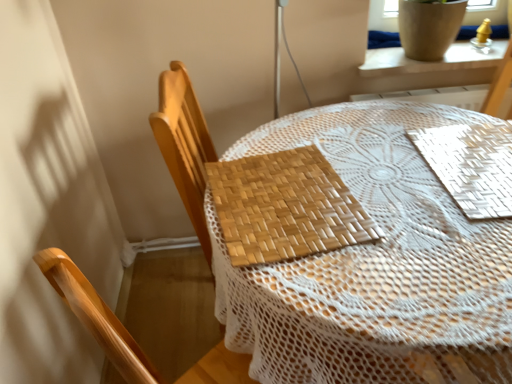
Where is `bamboo placemat at center`? The width and height of the screenshot is (512, 384). bamboo placemat at center is located at coordinates (374, 265).

What do you see at coordinates (374, 265) in the screenshot?
I see `bamboo placemat at center` at bounding box center [374, 265].

Describe the element at coordinates (285, 207) in the screenshot. The height and width of the screenshot is (384, 512). I see `woven wood placemat at center, marked as the first mat in a left-to-right arrangement` at that location.

What is the approximate height of woven wood placemat at center, marked as the first mat in a left-to-right arrangement?

0.93 inches.

Describe the element at coordinates (432, 62) in the screenshot. I see `white ceramic pot at upper right` at that location.

Find the location of a particular element. woven wood chair at center is located at coordinates (184, 145).

What do you see at coordinates (184, 145) in the screenshot?
I see `woven wood chair at center` at bounding box center [184, 145].

Where is `bamboo placemat at center`? The height and width of the screenshot is (384, 512). bamboo placemat at center is located at coordinates (374, 265).

Is woven wood placemat at center, the 2th mat positioned from the right, positioned far away from white ceramic pot at upper right?

No, woven wood placemat at center, the 2th mat positioned from the right, is in close proximity to white ceramic pot at upper right.

How distant is woven wood placemat at center, marked as the first mat in a left-to-right arrangement, from white ceramic pot at upper right?

They are 30.35 inches apart.

From the image's perspective, is woven wood placemat at center, marked as the first mat in a left-to-right arrangement, below white ceramic pot at upper right?

Indeed, from the image's perspective, woven wood placemat at center, marked as the first mat in a left-to-right arrangement, is shown beneath white ceramic pot at upper right.

Does woven wood chair at center lie behind woven wood placemat at center, marked as the first mat in a left-to-right arrangement?

Yes, it is.

This screenshot has width=512, height=384. I want to click on chair lying behind the woven wood placemat at center, marked as the first mat in a left-to-right arrangement, so click(184, 145).

Is woven wood chair at center not close to woven wood placemat at center, the 2th mat positioned from the right?

Actually, woven wood chair at center and woven wood placemat at center, the 2th mat positioned from the right, are a little close together.

Is woven wood placemat at center, marked as the first mat in a left-to-right arrangement, completely or partially inside woven wood chair at center?

No, woven wood placemat at center, marked as the first mat in a left-to-right arrangement, is located outside of woven wood chair at center.

Considering the relative positions of white ceramic pot at upper right and woven wood chair at center in the image provided, is white ceramic pot at upper right to the left or to the right of woven wood chair at center?

In the image, white ceramic pot at upper right appears on the right side of woven wood chair at center.

Does white ceramic pot at upper right have a lesser height compared to woven wood chair at center?

Correct, white ceramic pot at upper right is not as tall as woven wood chair at center.

Could you tell me if white ceramic pot at upper right is facing woven wood chair at center?

No, white ceramic pot at upper right does not turn towards woven wood chair at center.

Identify the location of chair in front of the white ceramic pot at upper right. (184, 145).

Considering the relative positions of bamboo placemat at center and white woven mat at upper right, arranged as the first mat when viewed from the right, in the image provided, is bamboo placemat at center to the left of white woven mat at upper right, arranged as the first mat when viewed from the right, from the viewer's perspective?

Indeed, bamboo placemat at center is positioned on the left side of white woven mat at upper right, arranged as the first mat when viewed from the right.

Who is taller, bamboo placemat at center or white woven mat at upper right, arranged as the second mat when viewed from the left?

Standing taller between the two is bamboo placemat at center.

What are the coordinates of `mat that is the 1st one above the bamboo placemat at center (from a real-world perspective)` in the screenshot? It's located at (471, 165).

Between point (197, 212) and point (418, 68), which one is positioned in front?

Point (197, 212)

Between woven wood chair at center and white ceramic pot at upper right, which one has more height?

woven wood chair at center is taller.

From a real-world perspective, between woven wood chair at center and white ceramic pot at upper right, who is vertically lower?

In real-world perspective, woven wood chair at center is lower.

Which object is wider, woven wood chair at center or white ceramic pot at upper right?

With larger width is woven wood chair at center.

From the image's perspective, is white ceramic pot at upper right over white woven mat at upper right, arranged as the second mat when viewed from the left?

Yes.

Considering the relative positions of white ceramic pot at upper right and white woven mat at upper right, arranged as the second mat when viewed from the left, in the image provided, is white ceramic pot at upper right to the left or to the right of white woven mat at upper right, arranged as the second mat when viewed from the left,?

From the image, it's evident that white ceramic pot at upper right is to the right of white woven mat at upper right, arranged as the second mat when viewed from the left.

Does white ceramic pot at upper right have a greater width compared to white woven mat at upper right, arranged as the first mat when viewed from the right?

No, white ceramic pot at upper right is not wider than white woven mat at upper right, arranged as the first mat when viewed from the right.

From a real-world perspective, which is physically below, white ceramic pot at upper right or white woven mat at upper right, arranged as the second mat when viewed from the left?

In real-world perspective, white woven mat at upper right, arranged as the second mat when viewed from the left, is lower.

Is point (471, 53) closer to viewer compared to point (380, 136)?

No, (471, 53) is behind (380, 136).

From the image's perspective, which is below, white ceramic pot at upper right or bamboo placemat at center?

bamboo placemat at center appears lower in the image.

Is white ceramic pot at upper right beside bamboo placemat at center?

white ceramic pot at upper right and bamboo placemat at center are clearly separated.

Where is `window sill above the woven wood placemat at center, the 2th mat positioned from the right (from a real-world perspective)`? This screenshot has width=512, height=384. window sill above the woven wood placemat at center, the 2th mat positioned from the right (from a real-world perspective) is located at coordinates (432, 62).

At what (x,y) coordinates should I click in order to perform the action: click on mat that is the 2nd one when counting forward from the woven wood chair at center. Please return your answer as a coordinate pair (x, y). The height and width of the screenshot is (384, 512). Looking at the image, I should click on (285, 207).

Which object lies further to the anchor point white woven mat at upper right, arranged as the first mat when viewed from the right, woven wood chair at center or white ceramic pot at upper right?

Among the two, woven wood chair at center is located further to white woven mat at upper right, arranged as the first mat when viewed from the right.

From the image, which object appears to be farther from bamboo placemat at center, woven wood placemat at center, the 2th mat positioned from the right, or white ceramic pot at upper right?

Based on the image, white ceramic pot at upper right appears to be further to bamboo placemat at center.

In the scene shown: Estimate the real-world distances between objects in this image. Which object is closer to woven wood chair at center, white ceramic pot at upper right or bamboo placemat at center?

Among the two, bamboo placemat at center is located nearer to woven wood chair at center.

When comparing their distances from woven wood chair at center, does white woven mat at upper right, arranged as the second mat when viewed from the left, or white ceramic pot at upper right seem further?

white ceramic pot at upper right is further to woven wood chair at center.

Estimate the real-world distances between objects in this image. Which object is further from woven wood chair at center, bamboo placemat at center or woven wood placemat at center, the 2th mat positioned from the right?

The object further to woven wood chair at center is bamboo placemat at center.

Looking at the image, which one is located closer to woven wood placemat at center, the 2th mat positioned from the right, white woven mat at upper right, arranged as the second mat when viewed from the left, or white ceramic pot at upper right?

white woven mat at upper right, arranged as the second mat when viewed from the left, is closer to woven wood placemat at center, the 2th mat positioned from the right.

Looking at the image, which one is located closer to woven wood placemat at center, marked as the first mat in a left-to-right arrangement, bamboo placemat at center or white woven mat at upper right, arranged as the first mat when viewed from the right?

bamboo placemat at center is positioned closer to the anchor woven wood placemat at center, marked as the first mat in a left-to-right arrangement.

When comparing their distances from white ceramic pot at upper right, does woven wood placemat at center, marked as the first mat in a left-to-right arrangement, or woven wood chair at center seem closer?

Among the two, woven wood chair at center is located nearer to white ceramic pot at upper right.

This screenshot has width=512, height=384. Identify the location of chair between bamboo placemat at center and white ceramic pot at upper right in the front-back direction. (184, 145).

In order to click on table between woven wood placemat at center, the 2th mat positioned from the right, and white woven mat at upper right, arranged as the first mat when viewed from the right, from left to right in this screenshot , I will do `click(374, 265)`.

The image size is (512, 384). I want to click on mat located between woven wood placemat at center, marked as the first mat in a left-to-right arrangement, and white ceramic pot at upper right in the depth direction, so click(x=471, y=165).

Locate an element on the screen. mat between woven wood chair at center and white woven mat at upper right, arranged as the first mat when viewed from the right is located at coordinates (285, 207).